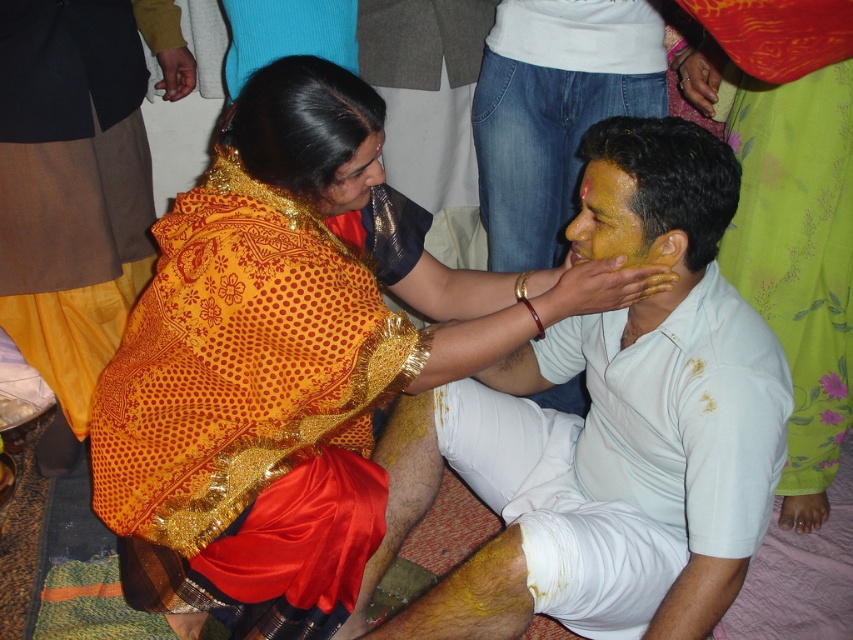
Question: Which object appears closest to the camera in this image?

Choices:
 (A) golden brocade saree at center
 (B) matte gold saree at center
 (C) yellow matte face at center

Answer: (A)

Question: Which is nearer to the white cotton shirt at center?

Choices:
 (A) matte gold saree at center
 (B) yellow matte face at center

Answer: (B)

Question: Is golden brocade saree at center below white cotton shirt at center?

Choices:
 (A) no
 (B) yes

Answer: (A)

Question: Is the position of golden brocade saree at center more distant than that of yellow matte face at center?

Choices:
 (A) no
 (B) yes

Answer: (A)

Question: Is golden brocade saree at center to the right of yellow matte face at center from the viewer's perspective?

Choices:
 (A) yes
 (B) no

Answer: (B)

Question: Which point is closer to the camera taking this photo?

Choices:
 (A) (283, 177)
 (B) (699, 173)

Answer: (A)